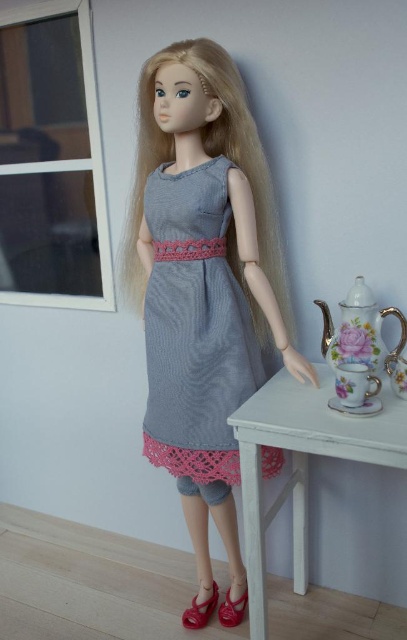
Question: Which object appears farthest from the camera in this image?

Choices:
 (A) shiny red leather shoe at lower center
 (B) knitted denim dress at center
 (C) knitted gray dress at center

Answer: (A)

Question: Can you confirm if white painted wood table at lower right is positioned above matte red shoe at lower center?

Choices:
 (A) no
 (B) yes

Answer: (B)

Question: Can you confirm if porcelain floral teapot at right is positioned to the right of matte red shoe at lower center?

Choices:
 (A) yes
 (B) no

Answer: (A)

Question: Based on their relative distances, which object is farther from the knitted denim dress at center?

Choices:
 (A) porcelain floral teapot at right
 (B) matte red shoe at lower center

Answer: (B)

Question: Can you confirm if knitted gray dress at center is positioned above porcelain floral teapot at right?

Choices:
 (A) yes
 (B) no

Answer: (A)

Question: Among these objects, which one is nearest to the camera?

Choices:
 (A) knitted gray dress at center
 (B) knitted denim dress at center

Answer: (A)